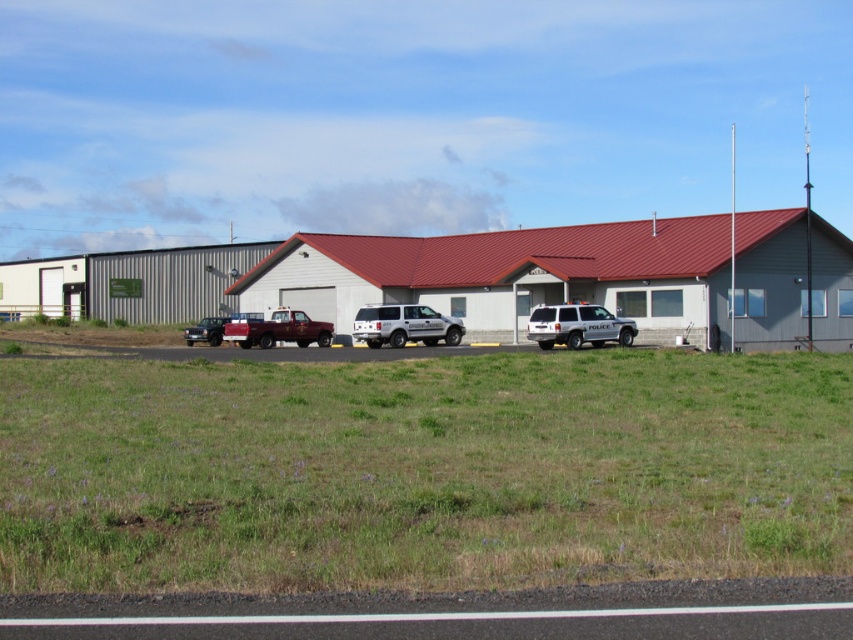
Is point (459, 576) less distant than point (189, 332)?

Yes, it is in front of point (189, 332).

Who is lower down, green grass at center or metallic silver suv at left?

Positioned lower is green grass at center.

Is point (323, 426) closer to camera compared to point (215, 316)?

Yes.

Locate an element on the screen. This screenshot has height=640, width=853. green grass at center is located at coordinates (422, 470).

Who is more distant from viewer, [825,369] or [398,323]?

The point [398,323] is more distant.

Which is in front, point (293, 561) or point (403, 340)?

Point (293, 561)

Where is `green grass at center`? Image resolution: width=853 pixels, height=640 pixels. green grass at center is located at coordinates (422, 470).

Who is lower down, brushed metal truck at center or metallic silver suv at left?

metallic silver suv at left

Which is in front, point (289, 333) or point (190, 332)?

Positioned in front is point (289, 333).

Find the location of a particular element. The image size is (853, 640). brushed metal truck at center is located at coordinates (277, 330).